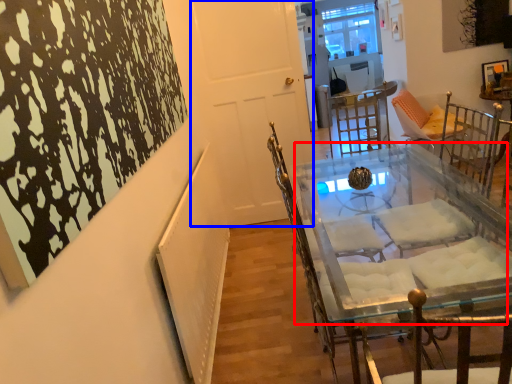
Question: Which object is closer to the camera taking this photo, round table (highlighted by a red box) or door (highlighted by a blue box)?

Choices:
 (A) round table
 (B) door

Answer: (A)